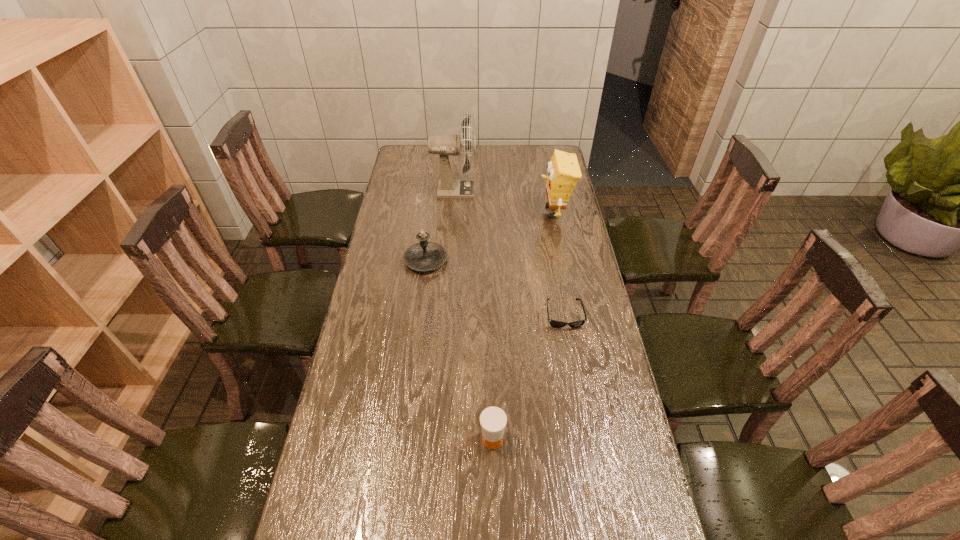
You are a GUI agent. You are given a task and a screenshot of the screen. Output one action in this format:
    pyautogui.click(x=<x>, y=<y>)
    Task: Click on the vacant space that is in between the third tallest object and the sunglasses
    
    Given the screenshot: What is the action you would take?
    pyautogui.click(x=495, y=288)

This screenshot has height=540, width=960. I want to click on free space between the second nearest object and the tallest object, so click(x=509, y=253).

Locate an element on the screen. the third closest object to the shortest object is located at coordinates (563, 172).

Identify which object is the third closest to the shortest object. Please provide its 2D coordinates. Your answer should be formatted as a tuple, i.e. [(x, y)], where the tuple contains the x and y coordinates of a point satisfying the conditions above.

[(563, 172)]